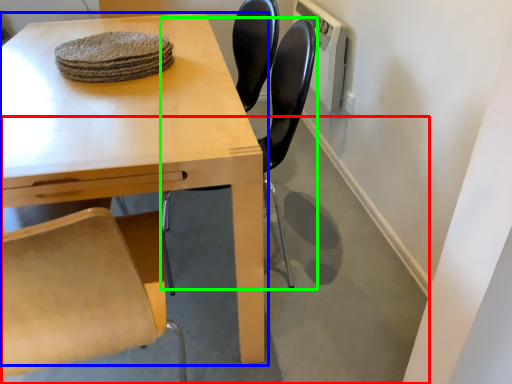
Question: Which is farther away from concrete (highlighted by a red box)? table (highlighted by a blue box) or chair (highlighted by a green box)?

Choices:
 (A) table
 (B) chair

Answer: (B)